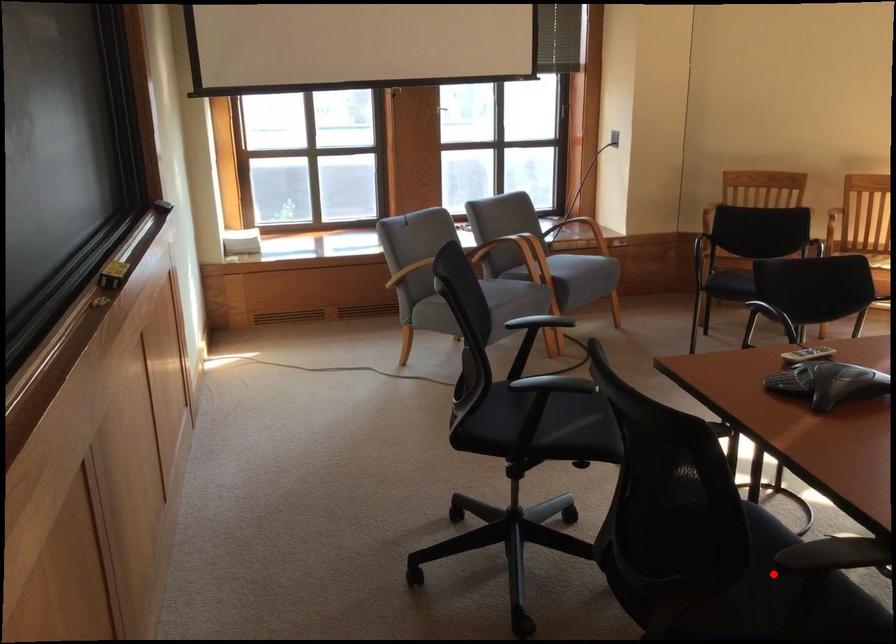
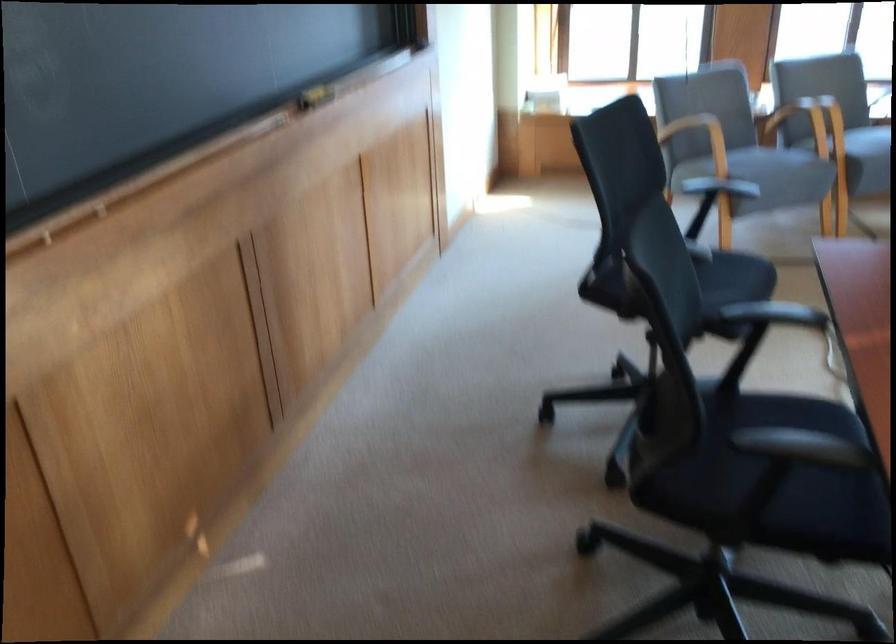
The point at the highlighted location is marked in the first image. Where is the corresponding point in the second image?

(789, 477)